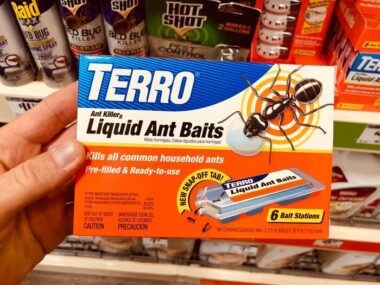
Find the location of a particular element. shelf with boxes of liquid ant baits is located at coordinates (355, 90), (351, 52), (343, 44).